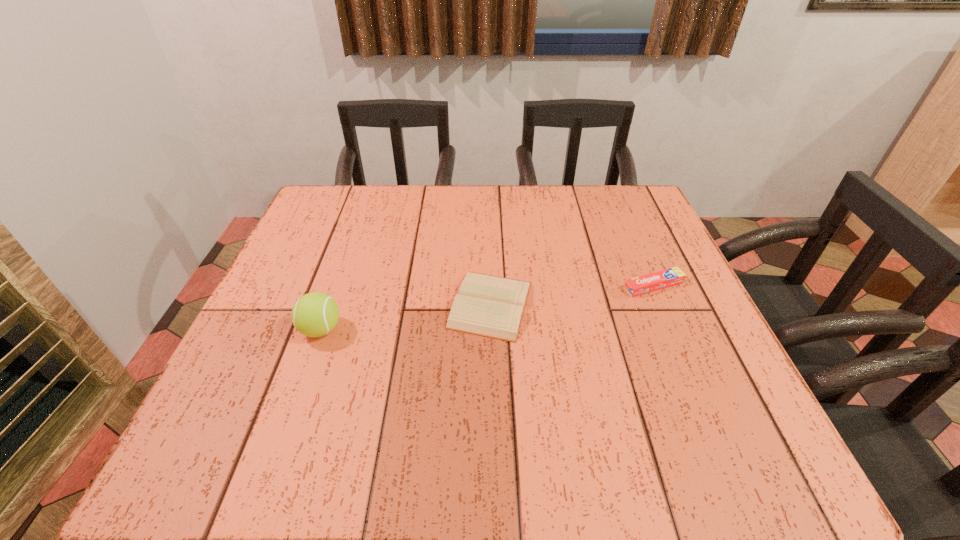
Locate an element on the screen. The height and width of the screenshot is (540, 960). vacant space at the near edge of the desktop is located at coordinates (373, 441).

At what (x,y) coordinates should I click in order to perform the action: click on blank space at the left edge. Please return your answer as a coordinate pair (x, y). The width and height of the screenshot is (960, 540). Looking at the image, I should click on (306, 269).

Where is `free space at the right edge`? The image size is (960, 540). free space at the right edge is located at coordinates (680, 421).

Find the location of `vacant area at the far left corner of the desktop`. vacant area at the far left corner of the desktop is located at coordinates (352, 193).

The image size is (960, 540). What are the coordinates of `free space at the near left corner` in the screenshot? It's located at (180, 463).

In the image, there is a desktop. Where is `vacant space at the far right corner`? The width and height of the screenshot is (960, 540). vacant space at the far right corner is located at coordinates (599, 187).

At what (x,y) coordinates should I click in order to perform the action: click on vacant region at the near right corner of the desktop. Please return your answer as a coordinate pair (x, y). Looking at the image, I should click on (758, 449).

At what (x,y) coordinates should I click in order to perform the action: click on empty space between the diary and the toothpaste. Please return your answer as a coordinate pair (x, y). This screenshot has height=540, width=960. Looking at the image, I should click on 572,295.

I want to click on empty space between the diary and the leftmost object, so click(406, 317).

The width and height of the screenshot is (960, 540). What are the coordinates of `vacant point located between the diary and the tennis ball` in the screenshot? It's located at (406, 317).